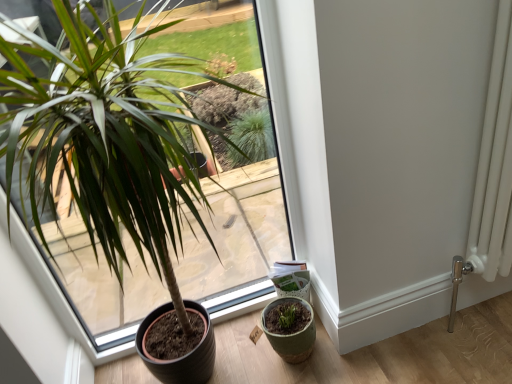
Where is `vacant space positioned to the left of green matte flowerpot at lower right`? vacant space positioned to the left of green matte flowerpot at lower right is located at coordinates (241, 348).